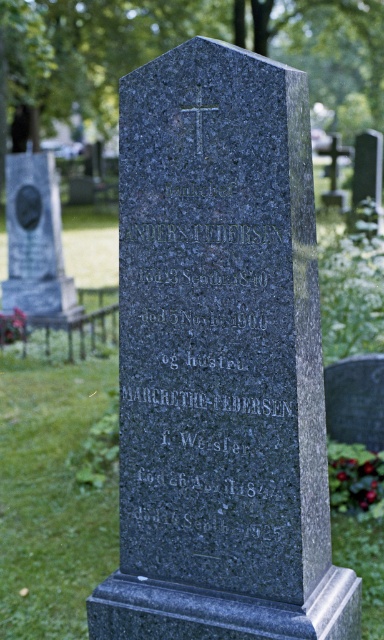
Which is below, granite gravestone at center or polished marble gravestone at left?

granite gravestone at center

Between granite gravestone at center and polished marble gravestone at left, which one is positioned higher?

polished marble gravestone at left is higher up.

You are a GUI agent. You are given a task and a screenshot of the screen. Output one action in this format:
    pyautogui.click(x=<x>, y=<y>)
    Task: Click on the granite gravestone at center
    
    Given the screenshot: What is the action you would take?
    pyautogui.click(x=220, y=362)

Locate an element on the screen. The height and width of the screenshot is (640, 384). granite gravestone at center is located at coordinates (220, 362).